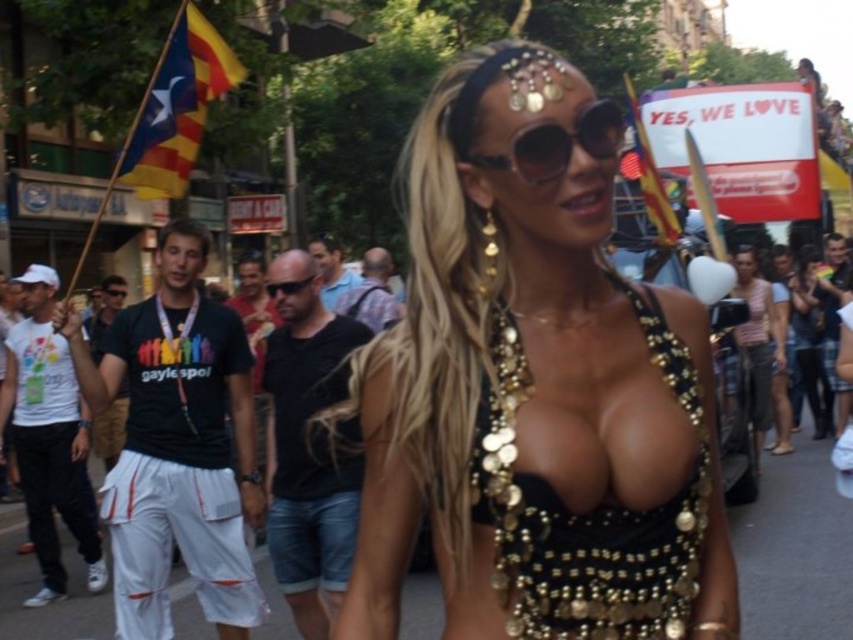
Question: Can you confirm if yellow fabric flag at upper right is positioned below black plastic sunglasses at center?

Choices:
 (A) yes
 (B) no

Answer: (B)

Question: Estimate the real-world distances between objects in this image. Which object is farther from the yellow fabric flag at upper right?

Choices:
 (A) black sequined dress at center
 (B) sunglasses at center
 (C) black metallic bra at center

Answer: (B)

Question: Can you confirm if black metallic bra at center is positioned to the left of yellow fabric flag at upper right?

Choices:
 (A) yes
 (B) no

Answer: (A)

Question: Which object appears closest to the camera in this image?

Choices:
 (A) black plastic sunglasses at center
 (B) gold sequined top at center

Answer: (A)

Question: Which object is farther from the camera taking this photo?

Choices:
 (A) black metallic bra at center
 (B) black sequined dress at center

Answer: (B)

Question: Is black metallic bra at center behind gold sequined top at center?

Choices:
 (A) no
 (B) yes

Answer: (A)